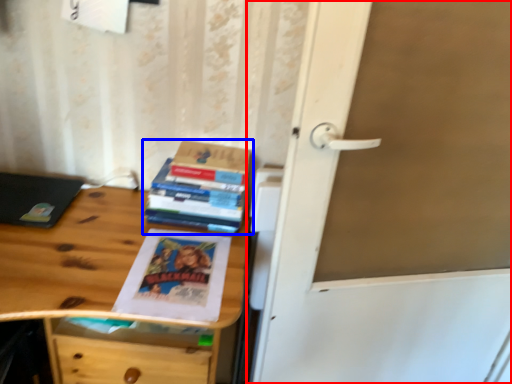
Question: Among these objects, which one is farthest to the camera, door (highlighted by a red box) or book (highlighted by a blue box)?

Choices:
 (A) door
 (B) book

Answer: (B)